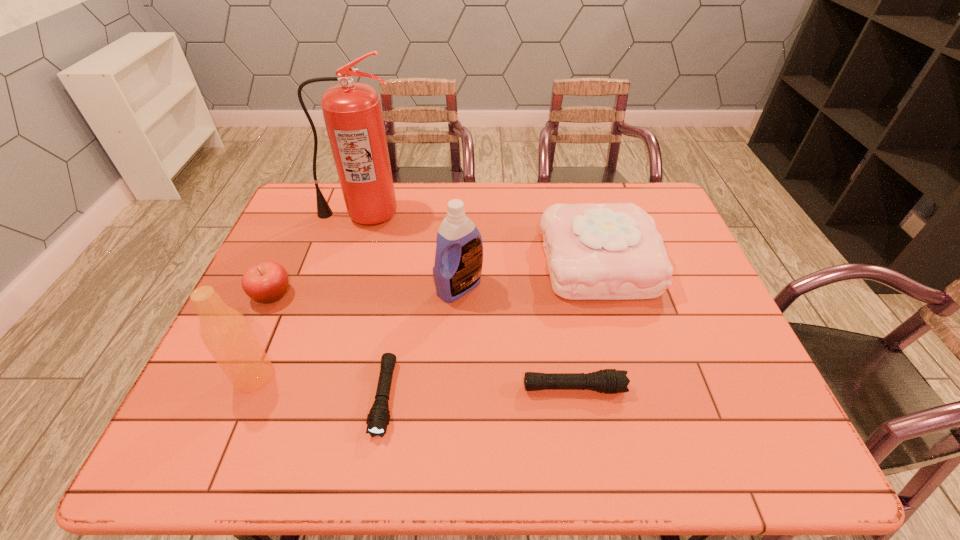
Identify the location of the shortest object. pyautogui.click(x=378, y=418).

Find the location of a particular element. This screenshot has height=540, width=960. the fourth object from left to right is located at coordinates (378, 418).

The width and height of the screenshot is (960, 540). I want to click on the right flashlight, so click(608, 381).

At what (x,y) coordinates should I click in order to perform the action: click on the taller flashlight. Please return your answer as a coordinate pair (x, y). Looking at the image, I should click on (608, 381).

The height and width of the screenshot is (540, 960). Identify the location of the tallest object. (352, 112).

I want to click on the fifth tallest object, so click(x=265, y=282).

Find the location of `the fourth tallest object`. the fourth tallest object is located at coordinates (612, 251).

Locate an element on the screen. detergent is located at coordinates (459, 247).

At what (x,y) coordinates should I click in order to perform the action: click on beer bottle. Please return your answer as a coordinate pair (x, y). The width and height of the screenshot is (960, 540). Looking at the image, I should click on (226, 333).

You are a GUI agent. You are given a task and a screenshot of the screen. Output one action in this format:
    pyautogui.click(x=<x>, y=<y>)
    Task: Click on the free space located 0.190m at the lens end of the right flashlight
    The image size is (960, 540).
    Given the screenshot: What is the action you would take?
    [708, 388]